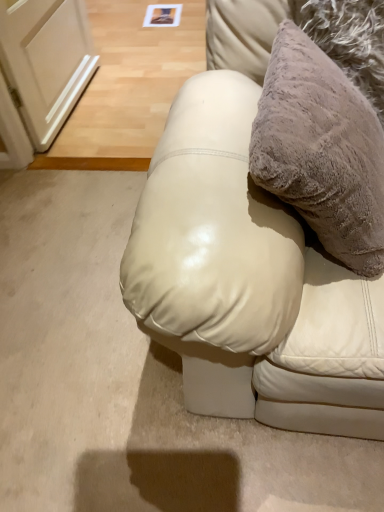
Question: Considering the positions of point pyautogui.click(x=374, y=195) and point pyautogui.click(x=157, y=143), is point pyautogui.click(x=374, y=195) closer or farther from the camera than point pyautogui.click(x=157, y=143)?

Choices:
 (A) closer
 (B) farther

Answer: (A)

Question: From a real-world perspective, is fuzzy beige pillow at upper right physically located above or below leather couch at center?

Choices:
 (A) above
 (B) below

Answer: (A)

Question: Is fuzzy beige pillow at upper right in front of or behind leather couch at center in the image?

Choices:
 (A) behind
 (B) front

Answer: (A)

Question: Is leather couch at center spatially inside fuzzy beige pillow at upper right, or outside of it?

Choices:
 (A) outside
 (B) inside

Answer: (A)

Question: In terms of height, does leather couch at center look taller or shorter compared to fuzzy beige pillow at upper right?

Choices:
 (A) tall
 (B) short

Answer: (A)

Question: From the image's perspective, is leather couch at center located above or below fuzzy beige pillow at upper right?

Choices:
 (A) below
 (B) above

Answer: (A)

Question: Considering the positions of point (241, 390) and point (360, 201), is point (241, 390) closer or farther from the camera than point (360, 201)?

Choices:
 (A) closer
 (B) farther

Answer: (B)